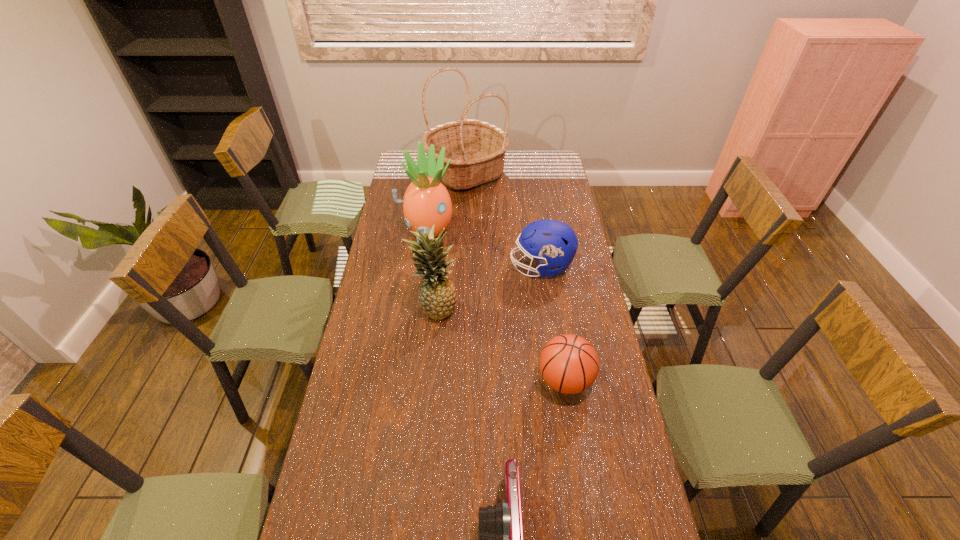
Where is `vacant area that satisfies the following two spatial constraints: 1. at the entrance of the fifth nearest object; 2. on the right side of the nearer pineapple`? This screenshot has height=540, width=960. vacant area that satisfies the following two spatial constraints: 1. at the entrance of the fifth nearest object; 2. on the right side of the nearer pineapple is located at coordinates (417, 307).

You are a GUI agent. You are given a task and a screenshot of the screen. Output one action in this format:
    pyautogui.click(x=<x>, y=<y>)
    Task: Click on the vacant region that satisfies the following two spatial constraints: 1. at the entrance of the fifth nearest object; 2. on the right side of the second nearest object
    The height and width of the screenshot is (540, 960).
    Given the screenshot: What is the action you would take?
    pyautogui.click(x=406, y=380)

Where is `vacant region that satisfies the following two spatial constraints: 1. at the entrance of the farther pineapple; 2. on the left side of the nearer pineapple`? This screenshot has width=960, height=540. vacant region that satisfies the following two spatial constraints: 1. at the entrance of the farther pineapple; 2. on the left side of the nearer pineapple is located at coordinates (417, 307).

At what (x,y) coordinates should I click in order to perform the action: click on blank space that satisfies the following two spatial constraints: 1. at the entrance of the second farthest object; 2. on the left side of the fourth farthest object. Please return your answer as a coordinate pair (x, y). This screenshot has height=540, width=960. Looking at the image, I should click on (417, 307).